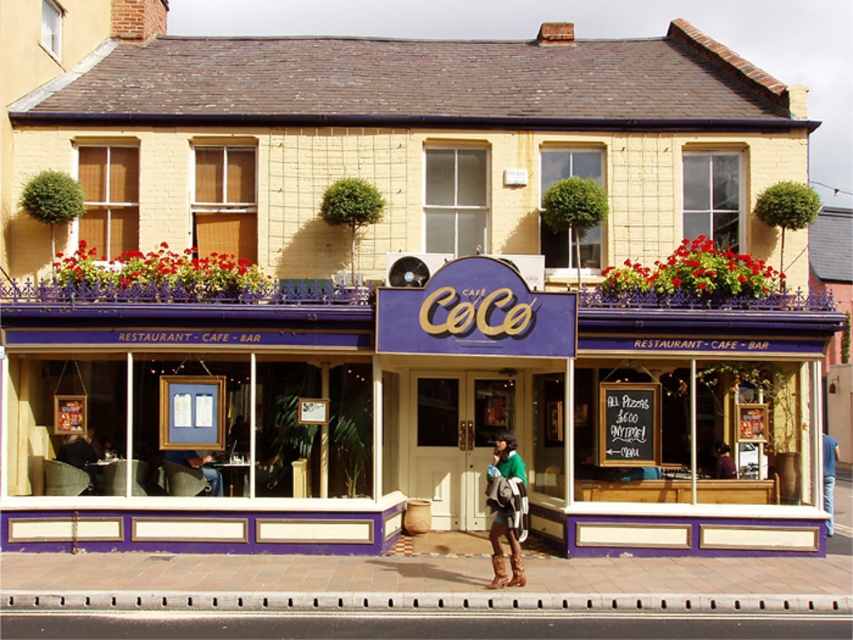
Question: Which point is farther from the camera taking this photo?

Choices:
 (A) (515, 570)
 (B) (717, 460)

Answer: (B)

Question: Is green knitted sweater at center below green fabric jacket at center?

Choices:
 (A) no
 (B) yes

Answer: (B)

Question: Does metallic gray curb at lower center come in front of green fabric jacket at center?

Choices:
 (A) no
 (B) yes

Answer: (B)

Question: Is green knitted sweater at center positioned behind green fabric jacket at center?

Choices:
 (A) no
 (B) yes

Answer: (A)

Question: Among these objects, which one is nearest to the camera?

Choices:
 (A) green fabric jacket at center
 (B) metallic gray curb at lower center

Answer: (B)

Question: Based on their relative distances, which object is nearer to the green knitted sweater at center?

Choices:
 (A) metallic gray curb at lower center
 (B) green fabric jacket at center

Answer: (A)